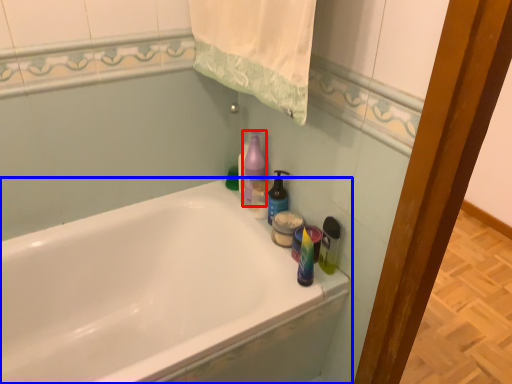
Question: Which object appears farthest to the camera in this image, cleaning product (highlighted by a red box) or bathtub (highlighted by a blue box)?

Choices:
 (A) cleaning product
 (B) bathtub

Answer: (A)